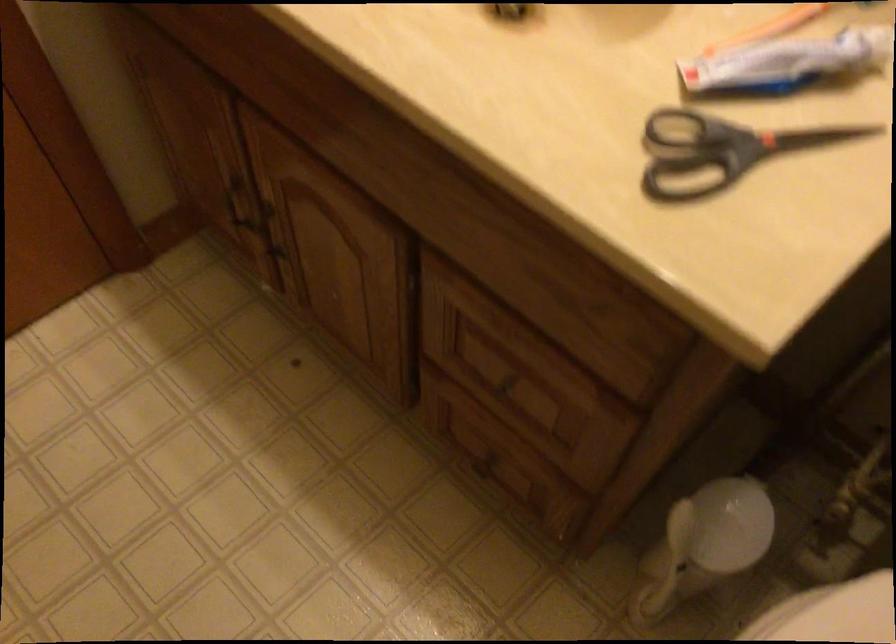
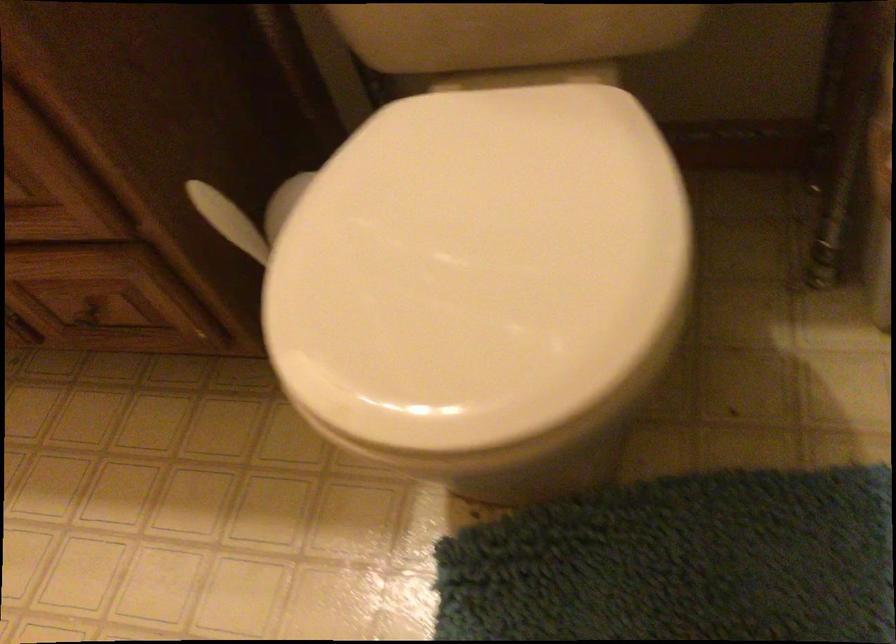
Locate, in the second image, the point that corresponds to point 686,529 in the first image.

(222, 214)